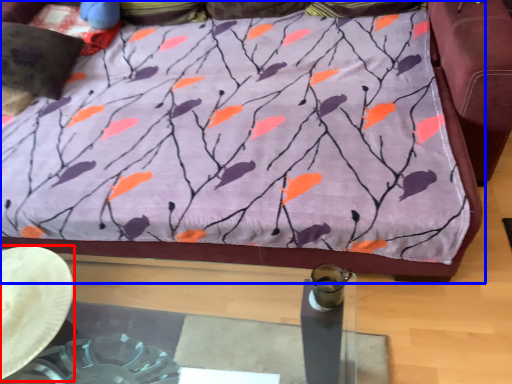
Question: Which point is closer to the camera, cowboy hat (highlighted by a red box) or furniture (highlighted by a blue box)?

Choices:
 (A) cowboy hat
 (B) furniture

Answer: (A)